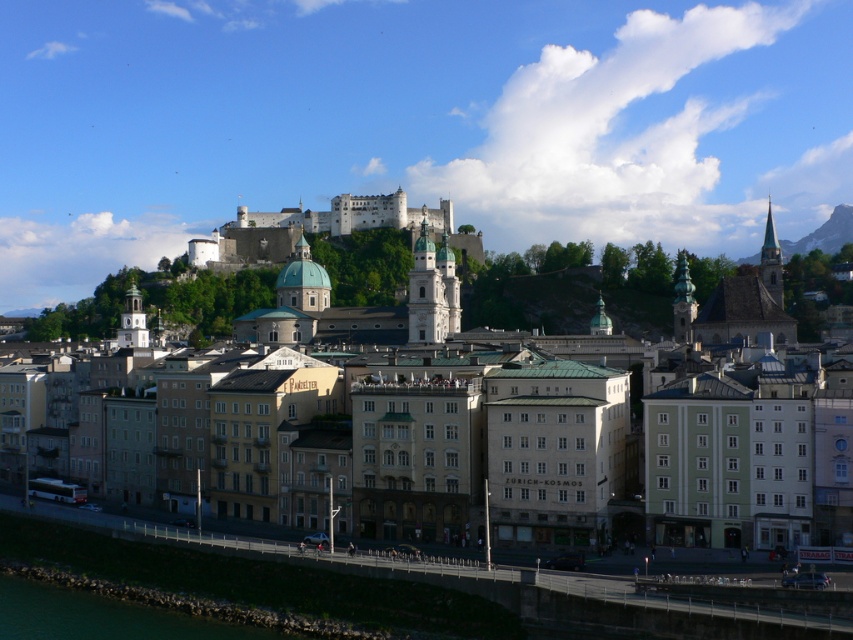
What do you see at coordinates (734, 308) in the screenshot? The height and width of the screenshot is (640, 853). I see `matte stone buildings at center` at bounding box center [734, 308].

Where is `matte stone buildings at center`? matte stone buildings at center is located at coordinates (734, 308).

Does point (734, 464) come in front of point (350, 227)?

Yes, point (734, 464) is in front of point (350, 227).

This screenshot has width=853, height=640. Identify the location of matte stone buildings at center. (734, 308).

Can you confirm if matte stone buildings at center is shorter than green stone wall at lower left?

No, matte stone buildings at center is not shorter than green stone wall at lower left.

Can you confirm if matte stone buildings at center is positioned above green stone wall at lower left?

Indeed, matte stone buildings at center is positioned over green stone wall at lower left.

This screenshot has height=640, width=853. Find the location of `matte stone buildings at center`. matte stone buildings at center is located at coordinates (734, 308).

Between white stone castle at upper center and green stone wall at lower left, which one is positioned lower?

green stone wall at lower left is below.

Can you confirm if white stone castle at upper center is positioned to the right of green stone wall at lower left?

Correct, you'll find white stone castle at upper center to the right of green stone wall at lower left.

Is point (335, 221) positioned after point (78, 627)?

Yes, it is.

The height and width of the screenshot is (640, 853). I want to click on white stone castle at upper center, so [323, 228].